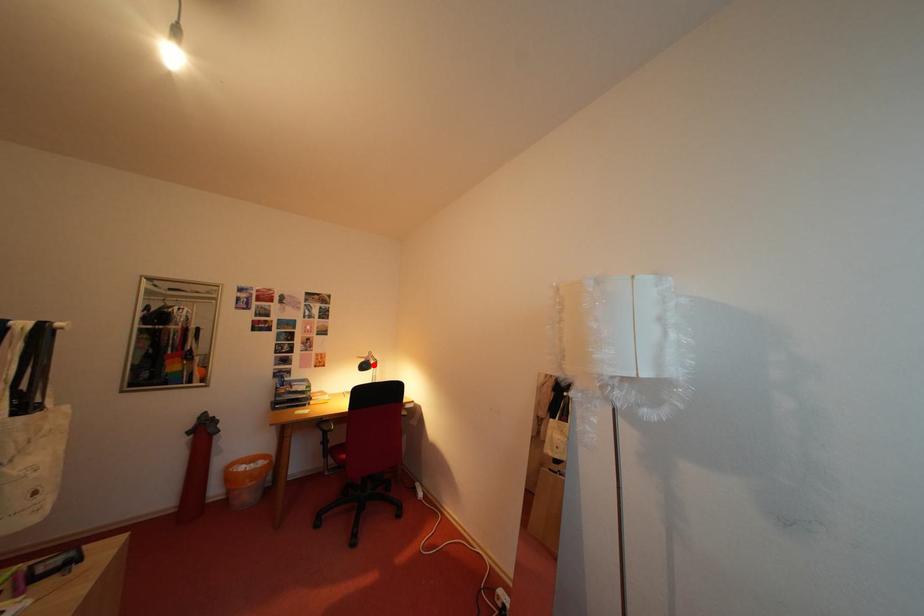
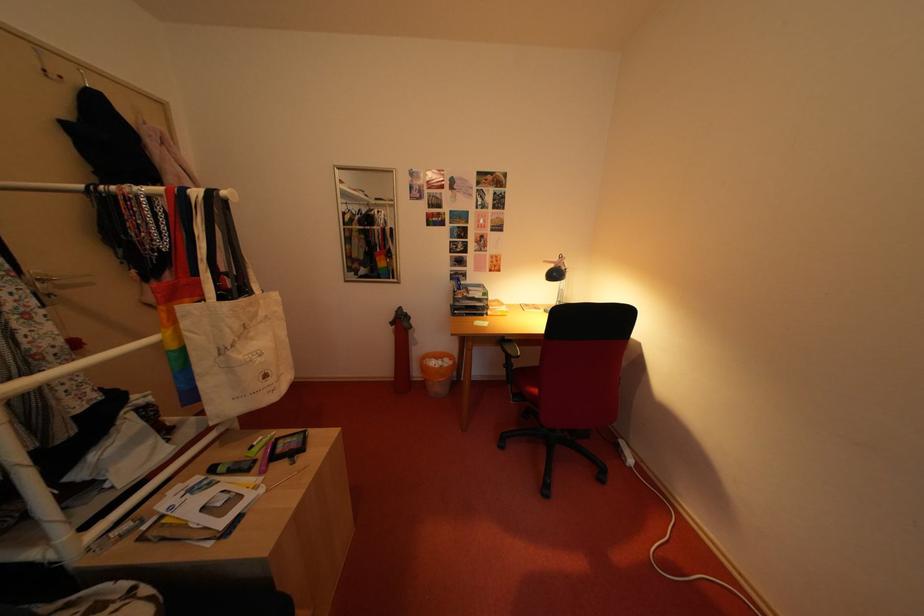
In the second image, find the point that corresponds to the highlighted location in the first image.

(563, 270)